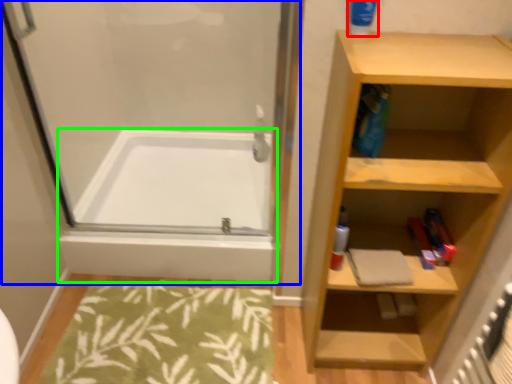
Question: Estimate the real-world distances between objects in this image. Which object is farther from cleaning product (highlighted by a red box), screen door (highlighted by a blue box) or bathtub (highlighted by a green box)?

Choices:
 (A) screen door
 (B) bathtub

Answer: (B)